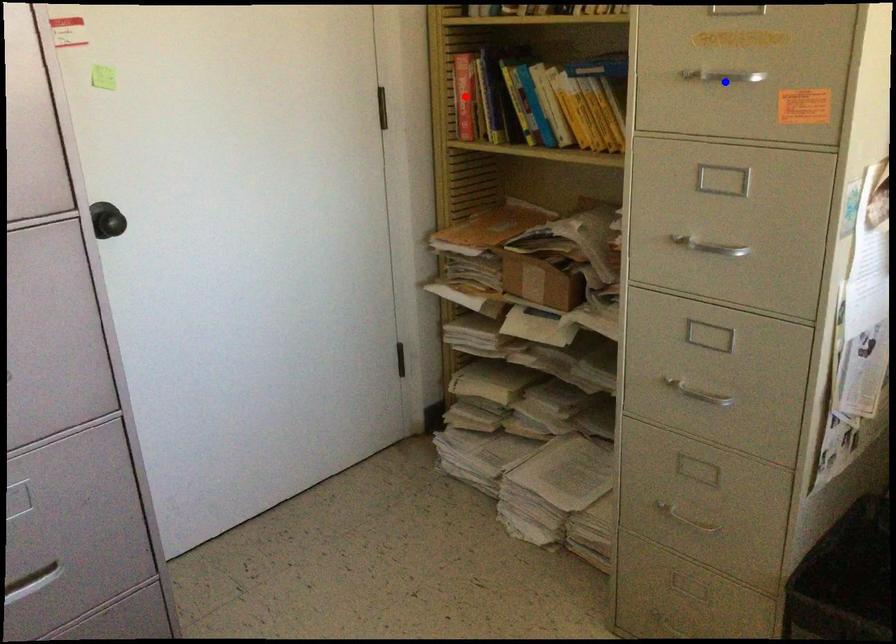
Question: In the image, two points are highlighted. Which point is nearer to the camera? Reply with the corresponding letter.

Choices:
 (A) blue point
 (B) red point

Answer: (A)